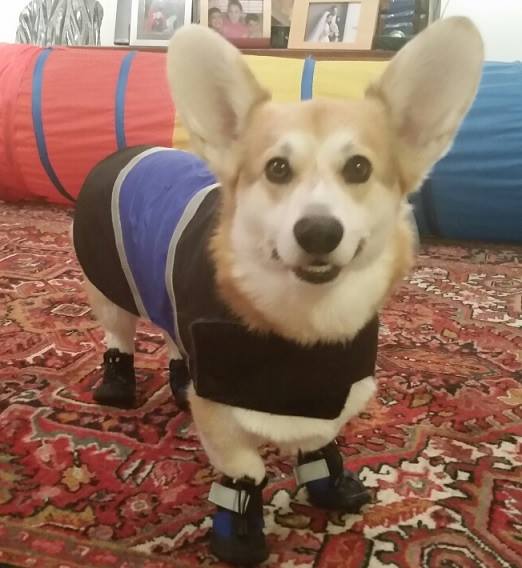
Find the location of a particular element. couch is located at coordinates (108, 145).